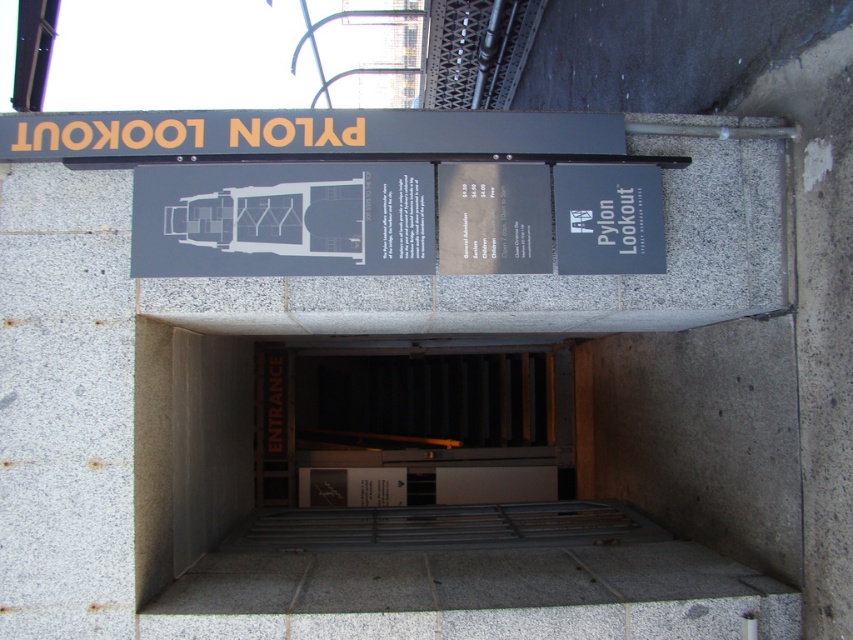
Question: Which object is farther from the camera taking this photo?

Choices:
 (A) metallic gray door at center
 (B) gray matte sign at center

Answer: (A)

Question: Which point is closer to the camera taking this photo?

Choices:
 (A) (277, 372)
 (B) (399, 224)

Answer: (B)

Question: Can you confirm if metallic gray door at center is positioned to the right of gray matte sign at center?

Choices:
 (A) yes
 (B) no

Answer: (B)

Question: Can you confirm if metallic gray door at center is positioned below gray matte sign at center?

Choices:
 (A) yes
 (B) no

Answer: (A)

Question: Does metallic gray door at center appear under gray matte sign at center?

Choices:
 (A) no
 (B) yes

Answer: (B)